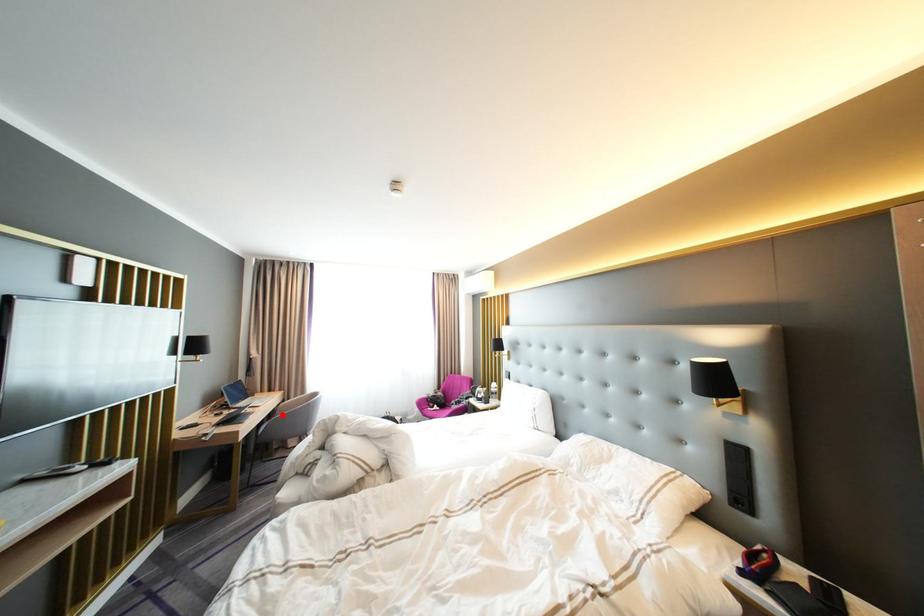
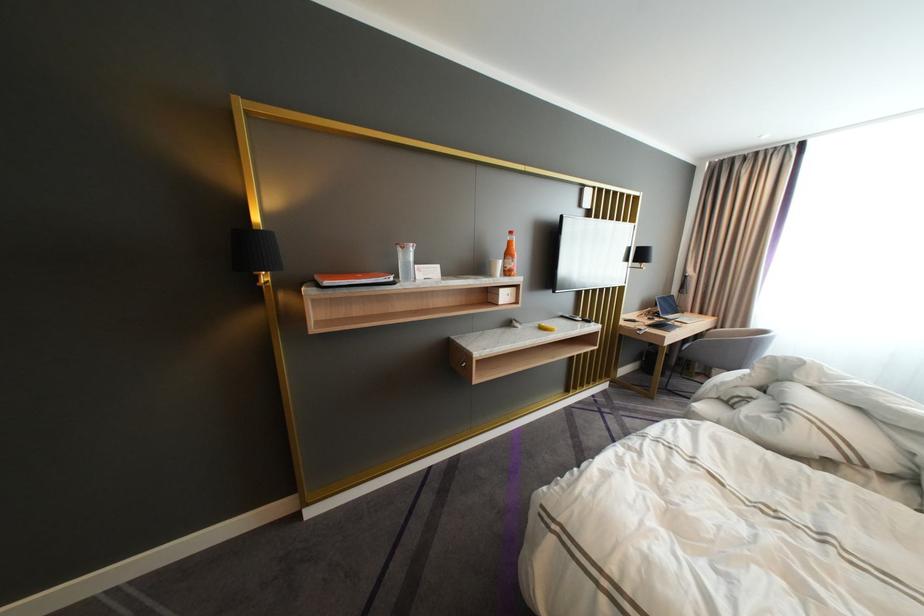
Locate, in the second image, the point that corresponds to the highlighted location in the first image.

(710, 338)